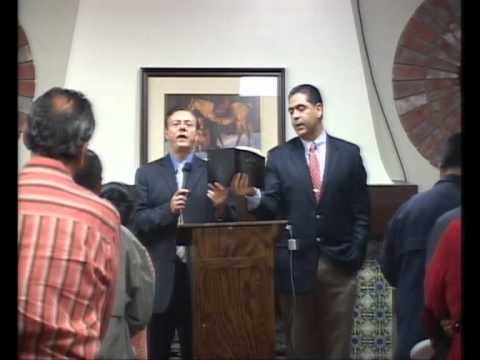
The image size is (480, 360). What are the coordinates of `tiled wall` in the screenshot? It's located at (374, 310).